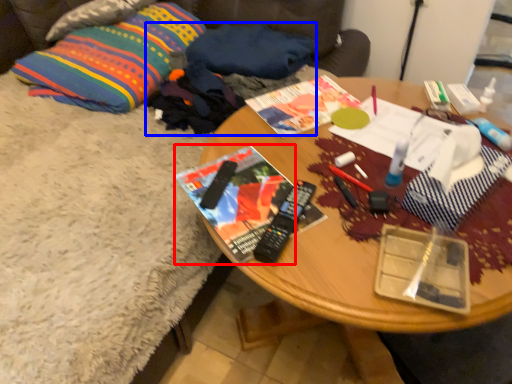
Question: Among these objects, which one is farthest to the camera, magazine (highlighted by a red box) or clothing (highlighted by a blue box)?

Choices:
 (A) magazine
 (B) clothing

Answer: (B)